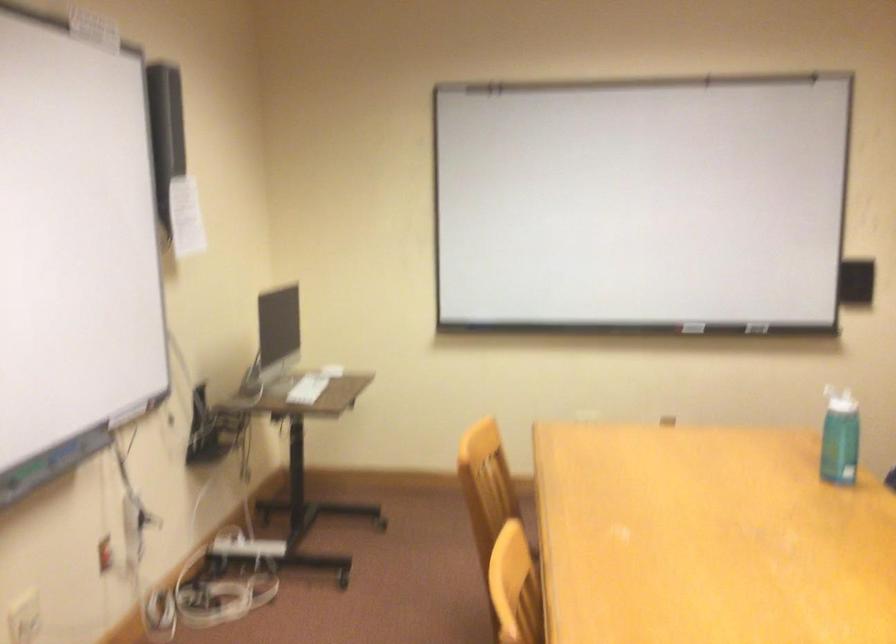
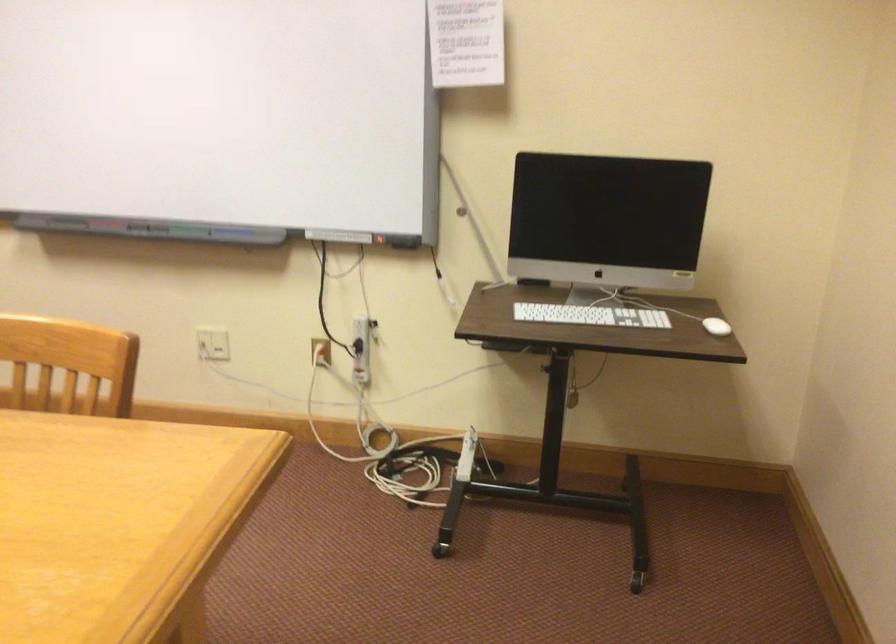
Find the pixel in the second image that matches [105,556] in the first image.

(321, 351)